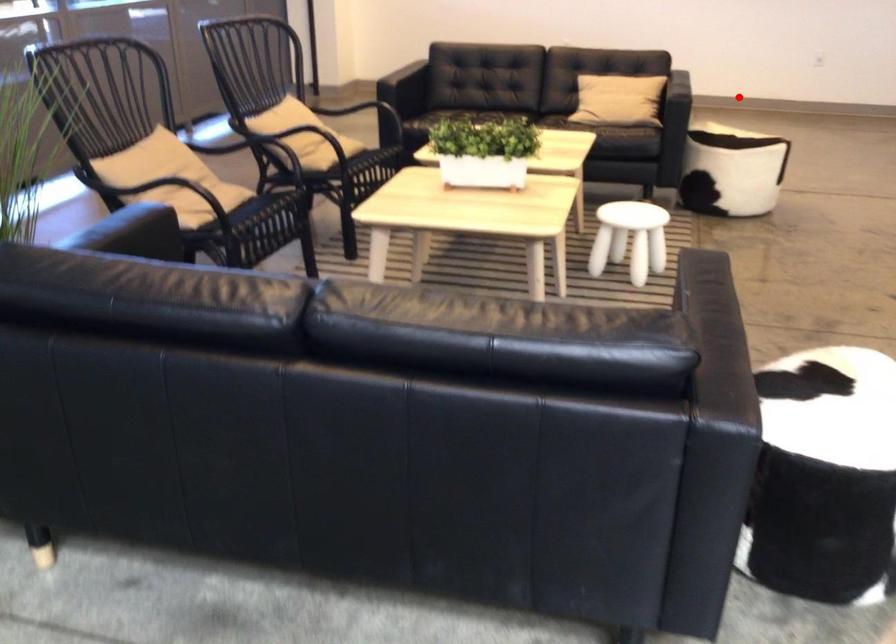
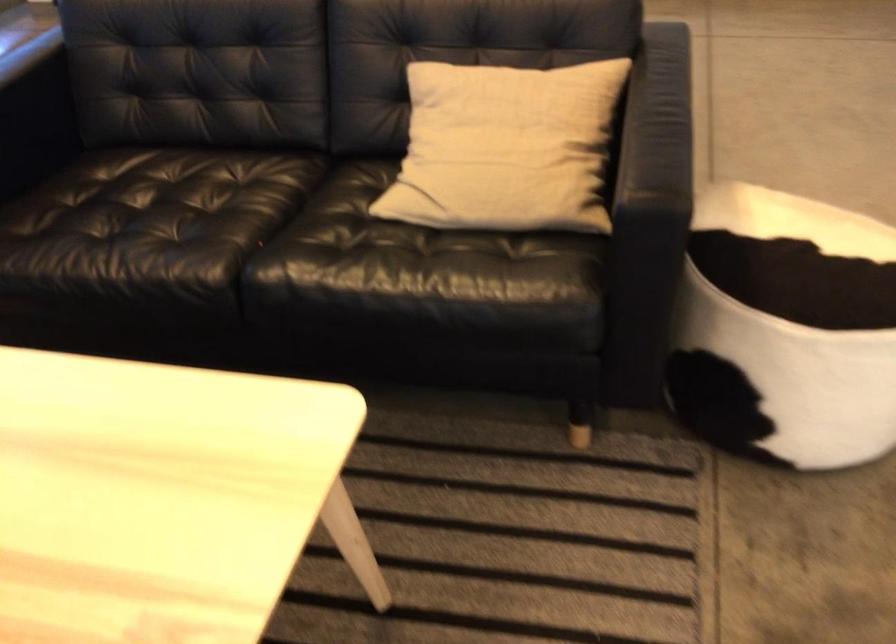
Where in the second image is the point corresponding to the highlighted location from the first image?

(693, 69)